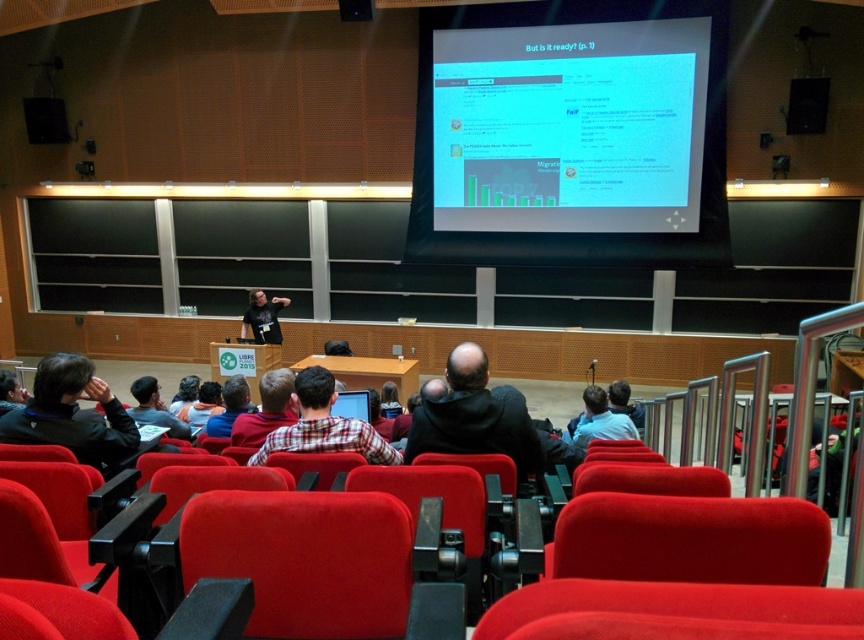
You are an event organizer who needs to ensure all attendees can see the speaker. You notice the plaid fabric shirt at center and the red fabric chair at center. Which object is wider, potentially blocking the view if it were an attendee?

The plaid fabric shirt at center is wider than the red fabric chair at center, so it would block the view more if it were an attendee.

You are sitting in the red seats and want to look at both the dark blue hoodie at lower left and the white glossy projector screen at upper center. Which object will you need to look upwards to see?

The white glossy projector screen at upper center is above the dark blue hoodie at lower left, so you will need to look upwards to see the white glossy projector screen at upper center.

In the scene shown: You are a photographer standing at the camera position. You want to capture a closeup shot of the red fabric chair at center. Can you walk forward to get closer without leaving the lecture hall? Explain your reasoning.

The red fabric chair at center is 2.38 meters away from the camera. Since the photographer is already at the camera position, moving forward would require stepping into the lecture hall space. However, the scene description does not mention any obstacles or restricted areas preventing movement closer to the chair. Therefore, the photographer can walk forward towards the red fabric chair at center to get a closer shot as long as there are no physical barriers in the way.